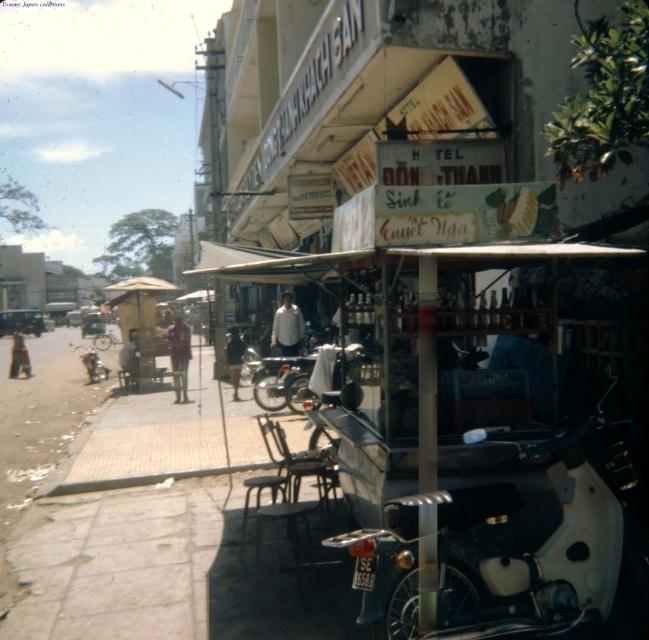
Measure the distance between dark blue shirt at center and camera.

dark blue shirt at center is 18.07 meters away from camera.

Is point (130, 378) positioned in front of point (95, 356)?

Yes, point (130, 378) is closer to viewer.

Is point (125, 368) farther from camera compared to point (86, 365)?

That is False.

Locate an element on the screen. dark blue shirt at center is located at coordinates (129, 362).

Is white matte motorcycle at center bigger than white matte shirt at center?

Correct, white matte motorcycle at center is larger in size than white matte shirt at center.

Does white matte motorcycle at center appear over white matte shirt at center?

Incorrect, white matte motorcycle at center is not positioned above white matte shirt at center.

This screenshot has height=640, width=649. Identify the location of white matte motorcycle at center. (511, 547).

Is white matte motorcycle at center bigger than purple fabric shirt at center?

No.

Which is below, white matte motorcycle at center or purple fabric shirt at center?

white matte motorcycle at center is lower down.

Is point (474, 548) more distant than point (177, 323)?

No, it is in front of (177, 323).

Where is `white matte motorcycle at center`? This screenshot has width=649, height=640. white matte motorcycle at center is located at coordinates coord(511,547).